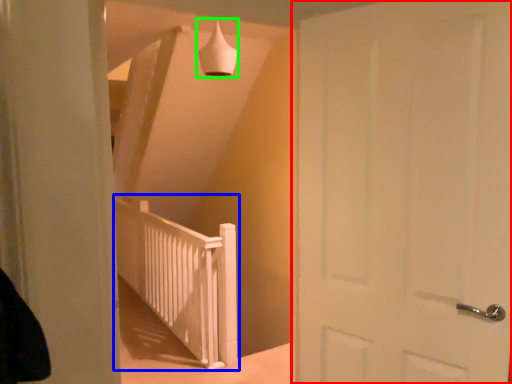
Question: Which object is the farthest from door (highlighted by a red box)? Choose among these: rail (highlighted by a blue box) or lamp (highlighted by a green box).

Choices:
 (A) rail
 (B) lamp

Answer: (A)